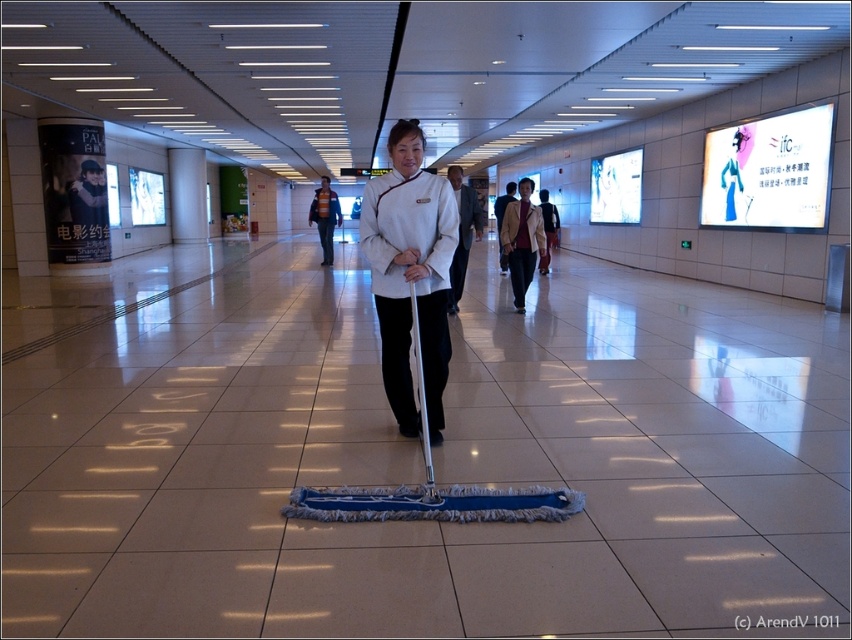
Question: Which of these objects is positioned farthest from the white fabric jacket at center?

Choices:
 (A) white matte uniform at center
 (B) dark brown leather jacket at center
 (C) striped sweater at center
 (D) white fabric coat at center

Answer: (C)

Question: Which point is farther from the camera taking this photo?

Choices:
 (A) (321, 241)
 (B) (419, 348)
 (C) (447, 307)
 (D) (510, 209)

Answer: (A)

Question: Does white fabric jacket at center appear over white fabric coat at center?

Choices:
 (A) yes
 (B) no

Answer: (A)

Question: Observing the image, what is the correct spatial positioning of white matte uniform at center in reference to striped sweater at center?

Choices:
 (A) right
 (B) left

Answer: (A)

Question: Is white fabric coat at center wider than striped sweater at center?

Choices:
 (A) yes
 (B) no

Answer: (B)

Question: Which point is farther from the camera taking this photo?

Choices:
 (A) (544, 230)
 (B) (377, 234)
 (C) (469, 211)
 (D) (332, 246)

Answer: (D)